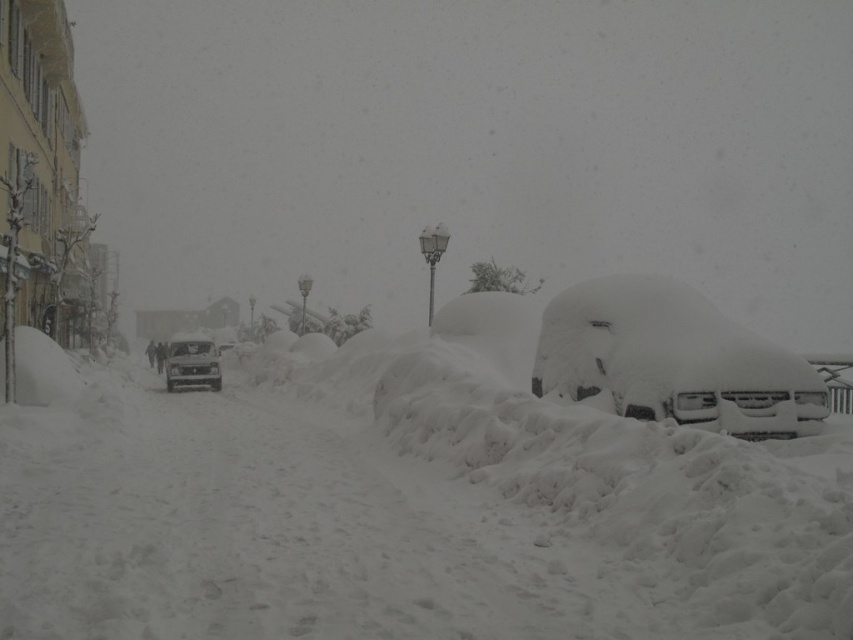
You are a delivery person trying to park your shiny silver car at center on a snowy street. There is white fluffy snow at center where you want to park. Is there enough space for the car to park there?

The white fluffy snow at center is below the shiny silver car at center, which means the car is already parked there. Therefore, there is enough space for the car to park there.